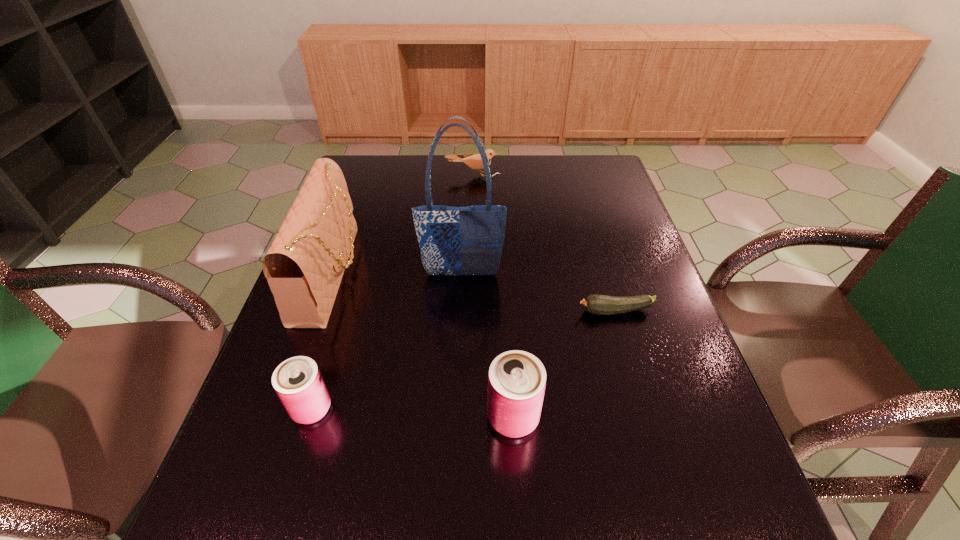
The width and height of the screenshot is (960, 540). What are the coordinates of `free spot that satisfies the following two spatial constraints: 1. on the front-facing side of the tallest object; 2. on the left side of the right can` in the screenshot? It's located at (456, 417).

Where is `free region that satisfies the following two spatial constraints: 1. on the front-facing side of the fifth shortest object; 2. on the left side of the shorter can`? This screenshot has width=960, height=540. free region that satisfies the following two spatial constraints: 1. on the front-facing side of the fifth shortest object; 2. on the left side of the shorter can is located at coordinates (285, 408).